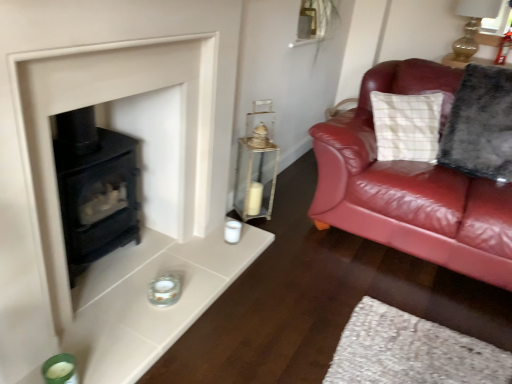
Question: Is green glass candle holder at lower left, marked as the first candle holder in a left-to-right arrangement, inside or outside of matte glass candle holder at lower center, which is the first candle holder in right-to-left order?

Choices:
 (A) inside
 (B) outside

Answer: (B)

Question: From the image's perspective, is green glass candle holder at lower left, which appears as the 2th candle holder when viewed from the right, located above or below matte glass candle holder at lower center, arranged as the 1th candle holder when viewed from the back?

Choices:
 (A) above
 (B) below

Answer: (B)

Question: Considering the real-world distances, which object is farthest from the green glass candle holder at lower left, which appears as the 2th candle holder when viewed from the right?

Choices:
 (A) matte glass candle holder at lower center, which appears as the 2th candle holder when viewed from the front
 (B) gold glass oil lamp at upper right
 (C) clear glass lantern at center
 (D) fluffy gray pillow at right
 (E) matte black stove at lower left

Answer: (B)

Question: Which of these objects is positioned farthest from the fluffy gray pillow at right?

Choices:
 (A) matte black stove at lower left
 (B) green glass candle holder at lower left, which appears as the 2th candle holder when viewed from the right
 (C) gold glass oil lamp at upper right
 (D) matte glass candle holder at lower center, which is the 2th candle holder in bottom-to-top order
 (E) clear glass lantern at center

Answer: (B)